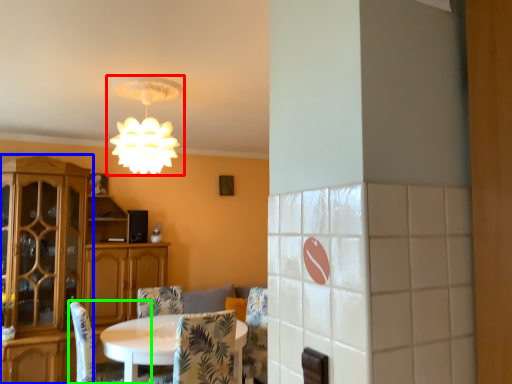
Question: Which object is positioned closest to lamp (highlighted by a red box)? Select from cabinetry (highlighted by a blue box) and chair (highlighted by a green box).

Choices:
 (A) cabinetry
 (B) chair

Answer: (B)